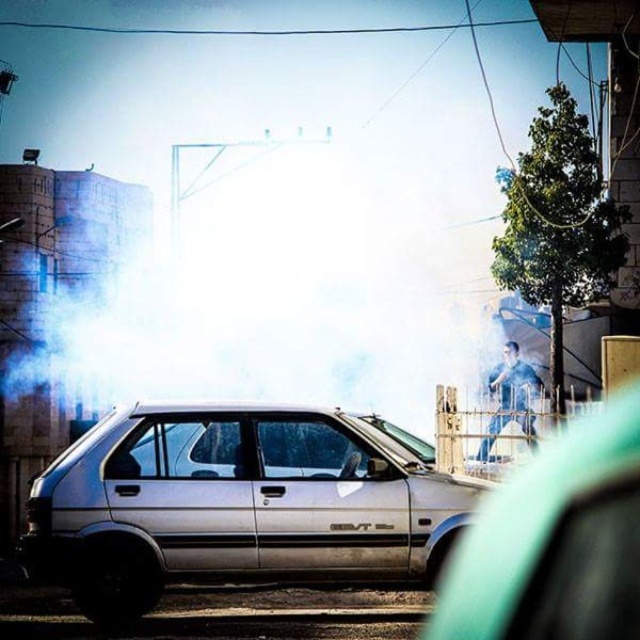
What are the coordinates of the white foggy smoke at center in the image?

The white foggy smoke at center is located at coordinates point (244, 282).

You are a delivery person trying to deliver a package to a customer. You see the white foggy smoke at center and the blue denim jeans at center in the scene. Which object takes up more space in the image?

The white foggy smoke at center takes up more space in the image as it is larger than the blue denim jeans at center.